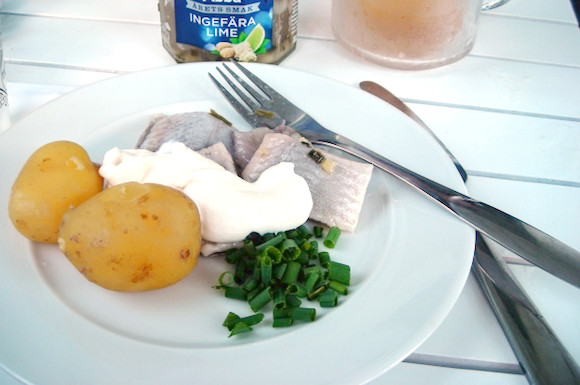
Locate an element on the screen. The image size is (580, 385). fork is located at coordinates coord(311,132).